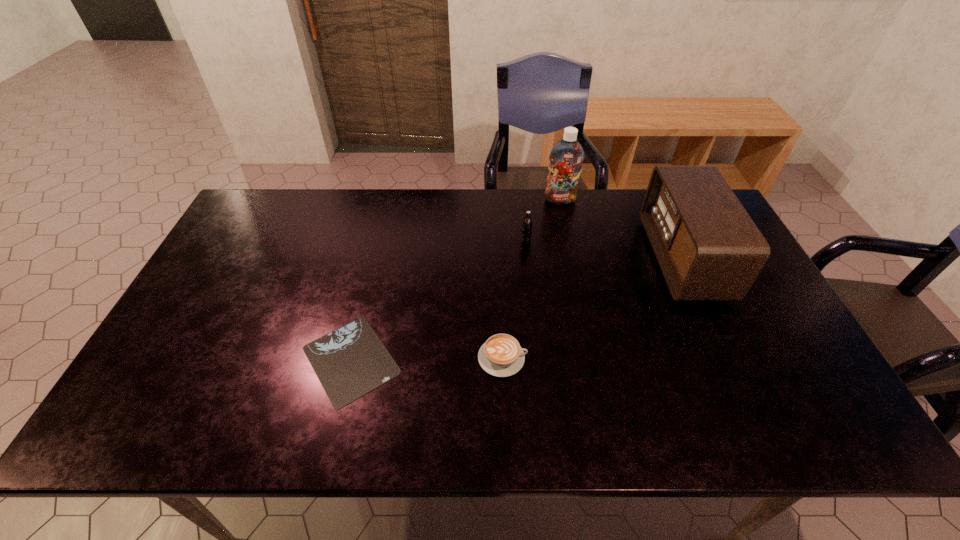
This screenshot has height=540, width=960. I want to click on the tallest object, so click(x=566, y=157).

Locate an element on the screen. The image size is (960, 540). shampoo is located at coordinates (566, 157).

At what (x,y) coordinates should I click in order to perform the action: click on the second tallest object. Please return your answer as a coordinate pair (x, y). This screenshot has height=540, width=960. Looking at the image, I should click on coord(708,247).

The height and width of the screenshot is (540, 960). I want to click on radio receiver, so [x=708, y=247].

At what (x,y) coordinates should I click in order to perform the action: click on the third tallest object. Please return your answer as a coordinate pair (x, y). Image resolution: width=960 pixels, height=540 pixels. Looking at the image, I should click on (526, 231).

Locate an element on the screen. The image size is (960, 540). pop is located at coordinates (526, 231).

In order to click on cappuccino in this screenshot , I will do `click(501, 355)`.

Locate an element on the screen. The height and width of the screenshot is (540, 960). the fourth object from right to left is located at coordinates (x=501, y=355).

Locate an element on the screen. The width and height of the screenshot is (960, 540). the leftmost object is located at coordinates (351, 361).

What are the coordinates of `mousepad` in the screenshot? It's located at (351, 361).